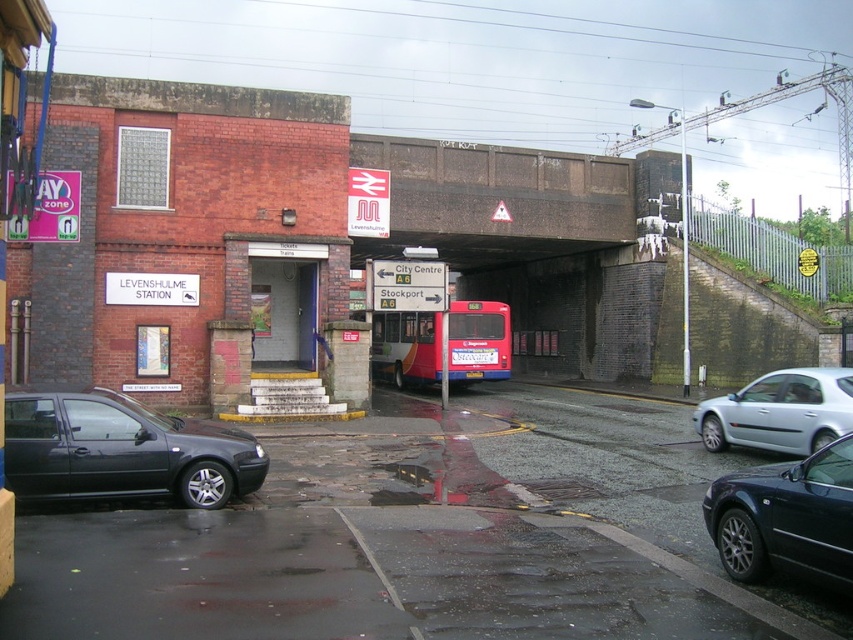
Is brown concrete bridge at upper center positioned at the back of red matte bus at center?

Yes, it is behind red matte bus at center.

Which is more to the right, brown concrete bridge at upper center or red matte bus at center?

brown concrete bridge at upper center

The height and width of the screenshot is (640, 853). What do you see at coordinates (495, 200) in the screenshot?
I see `brown concrete bridge at upper center` at bounding box center [495, 200].

Where is `brown concrete bridge at upper center`? The height and width of the screenshot is (640, 853). brown concrete bridge at upper center is located at coordinates (495, 200).

Can you confirm if shiny black sedan at lower right is positioned to the right of red matte bus at center?

Indeed, shiny black sedan at lower right is positioned on the right side of red matte bus at center.

Is shiny black sedan at lower right above red matte bus at center?

Incorrect, shiny black sedan at lower right is not positioned above red matte bus at center.

Measure the distance between shiny black sedan at lower right and camera.

17.90 feet

The width and height of the screenshot is (853, 640). Identify the location of shiny black sedan at lower right. (785, 516).

From the picture: Is brown concrete bridge at upper center in front of silver metallic car at right?

No.

In the scene shown: Can you confirm if brown concrete bridge at upper center is shorter than silver metallic car at right?

Incorrect, brown concrete bridge at upper center's height does not fall short of silver metallic car at right's.

This screenshot has height=640, width=853. Identify the location of brown concrete bridge at upper center. (495, 200).